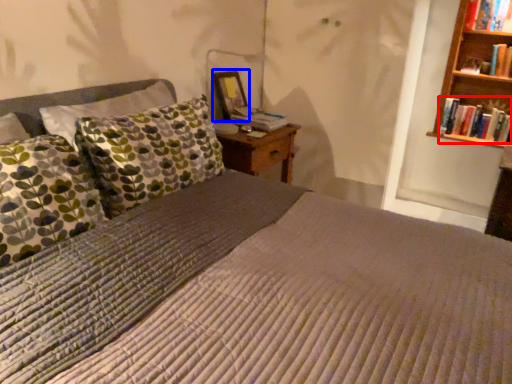
Question: Which of the following is the closest to the observer, book (highlighted by a red box) or picture frame (highlighted by a blue box)?

Choices:
 (A) book
 (B) picture frame

Answer: (B)